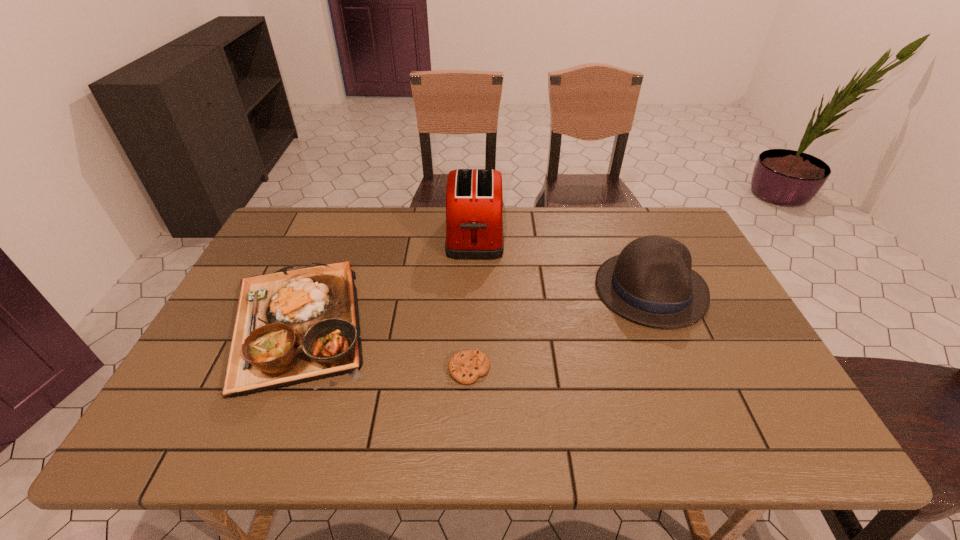
Where is `toaster`? The width and height of the screenshot is (960, 540). toaster is located at coordinates (474, 198).

You are a GUI agent. You are given a task and a screenshot of the screen. Output one action in this format:
    pyautogui.click(x=<x>, y=<y>)
    Task: Click on the second tallest object
    This screenshot has width=960, height=540.
    Given the screenshot: What is the action you would take?
    pyautogui.click(x=650, y=282)

Where is `bowler hat`? bowler hat is located at coordinates (650, 282).

Locate an element on the screen. The width and height of the screenshot is (960, 540). the third tallest object is located at coordinates (295, 326).

The height and width of the screenshot is (540, 960). Identify the location of the leftmost object. (295, 326).

The width and height of the screenshot is (960, 540). In order to click on the shortest object in this screenshot , I will do `click(466, 366)`.

Find the location of a particular element. free space located 0.270m on the left of the tallest object is located at coordinates (364, 235).

Image resolution: width=960 pixels, height=540 pixels. What are the coordinates of `vacant region located 0.170m on the front-facing side of the bowler hat` in the screenshot? It's located at (690, 387).

The width and height of the screenshot is (960, 540). In order to click on vacant area situated 0.120m on the right of the platter in this screenshot , I will do `click(423, 325)`.

You are a GUI agent. You are given a task and a screenshot of the screen. Output one action in this format:
    pyautogui.click(x=<x>, y=<y>)
    Task: Click on the free space located 0.190m on the right of the shortest object
    
    Given the screenshot: What is the action you would take?
    pyautogui.click(x=570, y=369)